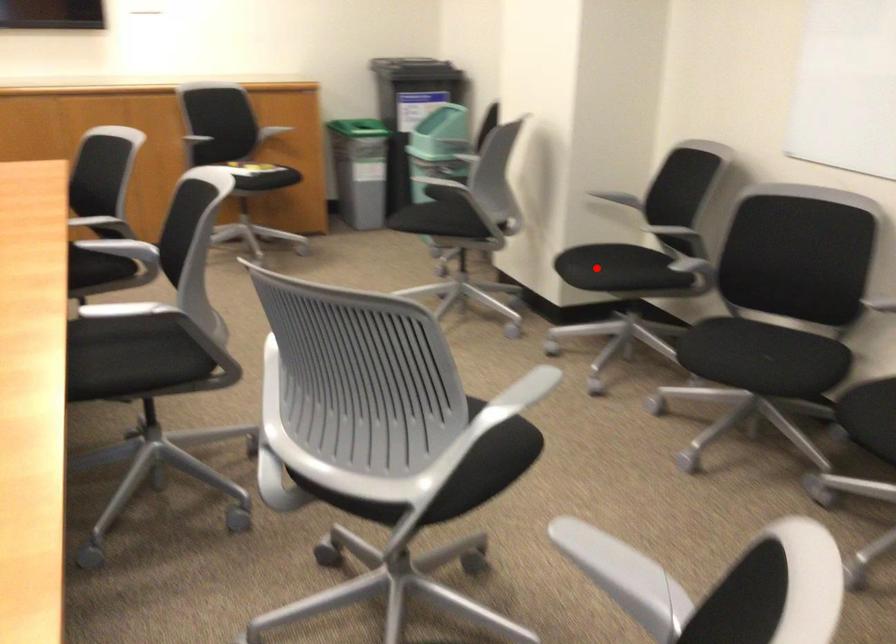
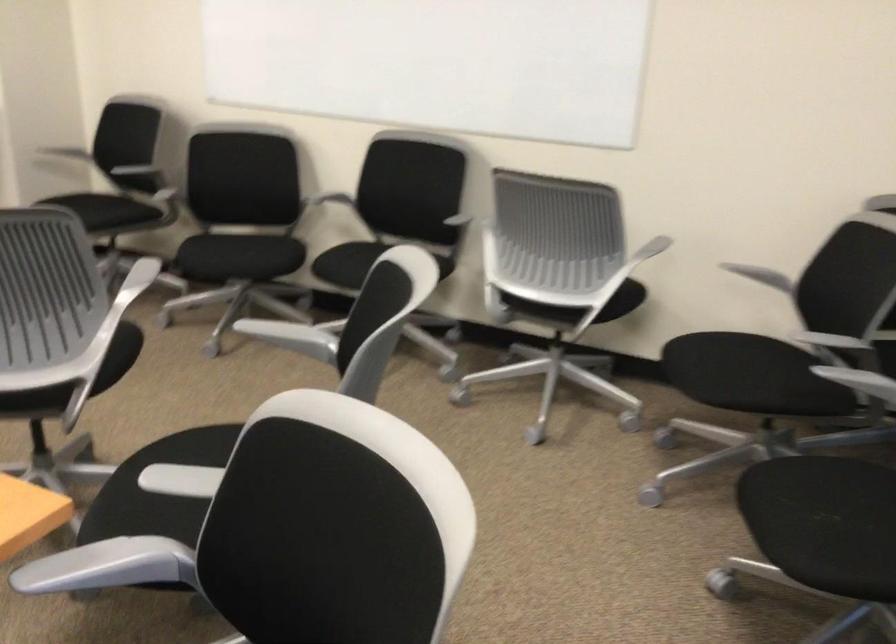
Question: A red point is marked in image1. In image2, is the corresponding 3D point closer to the camera or farther? Reply with the corresponding letter.

Choices:
 (A) The corresponding 3D point is closer.
 (B) The corresponding 3D point is farther.

Answer: (B)